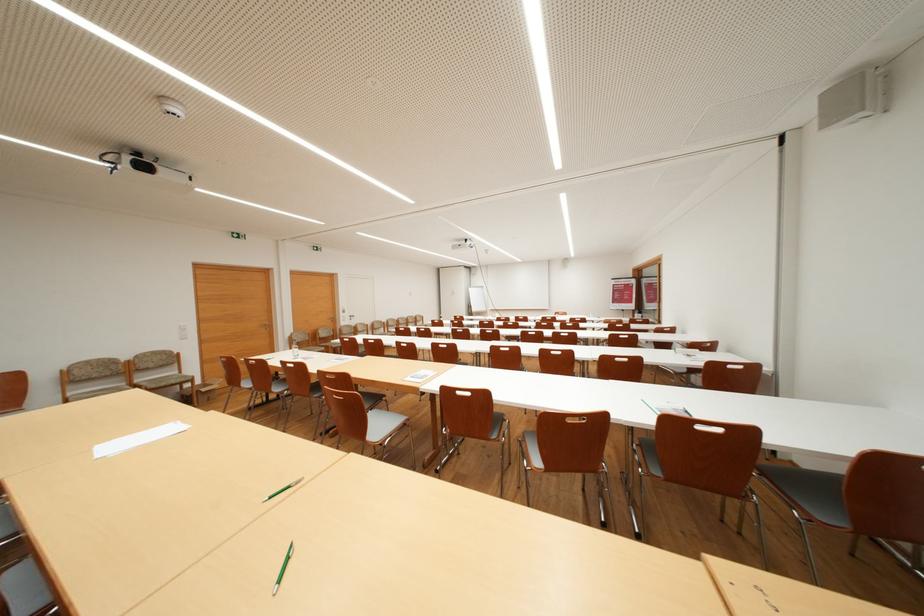
This screenshot has height=616, width=924. In order to click on wooden chair armrest in this screenshot , I will do `click(216, 410)`.